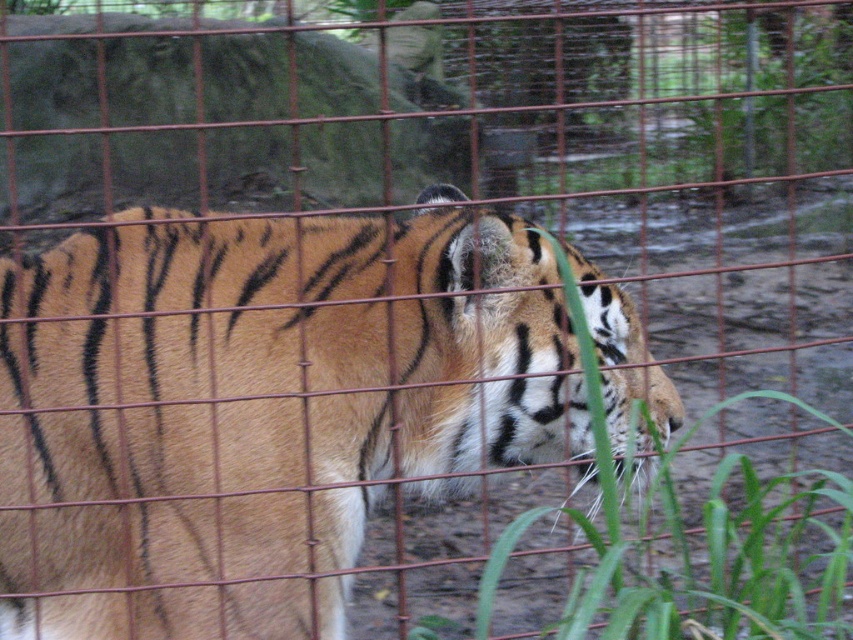
Question: Does orange fur tiger at center appear on the right side of green leafy grass at lower right?

Choices:
 (A) no
 (B) yes

Answer: (A)

Question: Is orange fur tiger at center closer to the viewer compared to green leafy grass at lower right?

Choices:
 (A) no
 (B) yes

Answer: (A)

Question: Where is orange fur tiger at center located in relation to green leafy grass at lower right in the image?

Choices:
 (A) right
 (B) left

Answer: (B)

Question: Which object appears closest to the camera in this image?

Choices:
 (A) green leafy grass at lower right
 (B) orange fur tiger at center

Answer: (A)

Question: Which point is closer to the camera?

Choices:
 (A) orange fur tiger at center
 (B) green leafy grass at lower right

Answer: (B)

Question: Among these points, which one is farthest from the camera?

Choices:
 (A) (703, 627)
 (B) (113, 624)

Answer: (B)